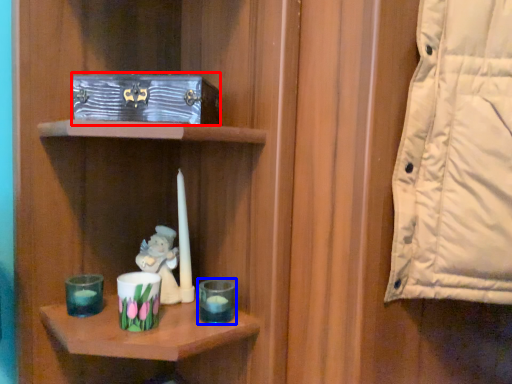
Question: Which point is further to the camera, box (highlighted by a red box) or candle holder (highlighted by a blue box)?

Choices:
 (A) box
 (B) candle holder

Answer: (B)